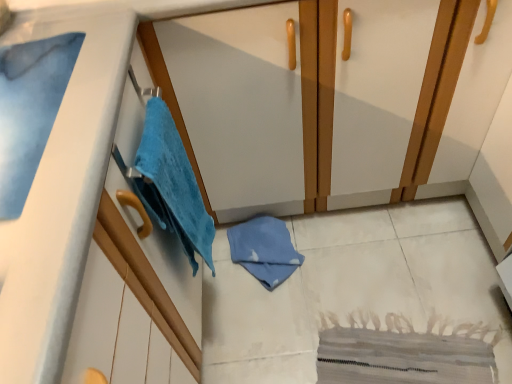
This screenshot has width=512, height=384. What are the coordinates of `blue soft towel at left` in the screenshot? It's located at (172, 185).

This screenshot has height=384, width=512. Describe the element at coordinates (30, 110) in the screenshot. I see `blue soft towel at upper left` at that location.

Locate an element on the screen. Image resolution: width=512 pixels, height=384 pixels. matte white dresser at center is located at coordinates (312, 100).

The image size is (512, 384). Identify the location of blue soft towel at left. (172, 185).

Is blue soft towel at upper left bigger than matte white dresser at center?

Actually, blue soft towel at upper left might be smaller than matte white dresser at center.

Would you consider blue soft towel at upper left to be distant from matte white dresser at center?

Actually, blue soft towel at upper left and matte white dresser at center are a little close together.

Is point (5, 194) farther from camera compared to point (231, 205)?

No, (5, 194) is closer to viewer.

Looking at this image, what's the angular difference between blue soft towel at upper left and matte white dresser at center's facing directions?

The facing directions of blue soft towel at upper left and matte white dresser at center are 88.8 degrees apart.

Can you tell me how much blue soft towel at left and blue soft towel at upper left differ in facing direction?

The angular difference between blue soft towel at left and blue soft towel at upper left is 0.00114 degrees.

Does point (146, 155) come in front of point (51, 106)?

No, (146, 155) is further to viewer.

In terms of height, does blue soft towel at left look taller or shorter compared to blue soft towel at upper left?

Clearly, blue soft towel at left is taller compared to blue soft towel at upper left.

Is blue soft towel at left in front of or behind blue soft towel at upper left in the image?

Clearly, blue soft towel at left is behind blue soft towel at upper left.

Which point is more distant from viewer, [282,107] or [170,178]?

The point [282,107] is farther from the camera.

Between matte white dresser at center and blue soft towel at left, which one has smaller width?

With smaller width is blue soft towel at left.

Looking at this image, is matte white dresser at center not near blue soft towel at left?

No.

Between matte white dresser at center and blue soft towel at left, which one appears on the left side from the viewer's perspective?

blue soft towel at left.

Can you confirm if blue soft towel at upper left is taller than blue soft towel at left?

Incorrect, the height of blue soft towel at upper left is not larger of that of blue soft towel at left.

From the image's perspective, which is below, blue soft towel at upper left or blue soft towel at left?

blue soft towel at left appears lower in the image.

Which is correct: blue soft towel at upper left is inside blue soft towel at left, or outside of it?

The correct answer is: outside.

Considering the relative sizes of blue soft towel at upper left and blue soft towel at left in the image provided, is blue soft towel at upper left thinner than blue soft towel at left?

No.

Which object is further away from the camera, matte white dresser at center or blue soft towel at upper left?

matte white dresser at center is more distant.

Considering the sizes of objects matte white dresser at center and blue soft towel at upper left in the image provided, who is smaller, matte white dresser at center or blue soft towel at upper left?

blue soft towel at upper left is smaller.

How different are the orientations of matte white dresser at center and blue soft towel at upper left in degrees?

They differ by 88.8 degrees in their facing directions.

Would you say blue soft towel at upper left is part of matte white dresser at center's contents?

No, matte white dresser at center does not contain blue soft towel at upper left.

From the image's perspective, is blue soft towel at left above or below matte white dresser at center?

From the image's perspective, blue soft towel at left appears below matte white dresser at center.

Which of these two, blue soft towel at left or matte white dresser at center, is bigger?

With larger size is matte white dresser at center.

Which is more to the left, blue soft towel at left or matte white dresser at center?

Positioned to the left is blue soft towel at left.

In the scene shown: Between blue soft towel at left and matte white dresser at center, which one has larger width?

matte white dresser at center.

At what (x,y) coordinates should I click in order to perform the action: click on bath towel lying below the matte white dresser at center (from the image's perspective). Please return your answer as a coordinate pair (x, y). This screenshot has height=384, width=512. Looking at the image, I should click on (30, 110).

At what (x,y) coordinates should I click in order to perform the action: click on beach towel on the right side of blue soft towel at upper left. Please return your answer as a coordinate pair (x, y). Looking at the image, I should click on (172, 185).

Based on the photo, from the image, which object appears to be nearer to blue soft towel at upper left, matte white dresser at center or blue soft towel at left?

Based on the image, blue soft towel at left appears to be nearer to blue soft towel at upper left.

From the picture: Which object lies further to the anchor point blue soft towel at left, blue soft towel at upper left or matte white dresser at center?

matte white dresser at center lies further to blue soft towel at left than the other object.

Based on their spatial positions, is matte white dresser at center or blue soft towel at upper left further from blue soft towel at left?

Based on the image, matte white dresser at center appears to be further to blue soft towel at left.

From the image, which object appears to be nearer to blue soft towel at upper left, blue soft towel at left or matte white dresser at center?

blue soft towel at left lies closer to blue soft towel at upper left than the other object.

Looking at the image, which one is located closer to matte white dresser at center, blue soft towel at left or blue soft towel at upper left?

Based on the image, blue soft towel at left appears to be nearer to matte white dresser at center.

Considering their positions, is blue soft towel at upper left positioned closer to matte white dresser at center than blue soft towel at left?

Based on the image, blue soft towel at left appears to be nearer to matte white dresser at center.

Find the location of `beach towel between blue soft towel at upper left and matte white dresser at center in the horizontal direction`. beach towel between blue soft towel at upper left and matte white dresser at center in the horizontal direction is located at coordinates (172, 185).